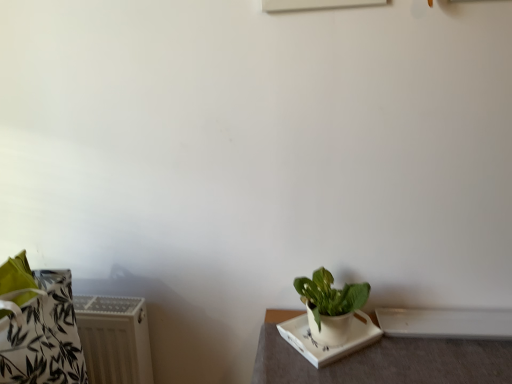
Identify the location of white ceramic plate at lower right. (326, 345).

Locate an element on the screen. white ceramic tray at lower right is located at coordinates (384, 360).

Image resolution: width=512 pixels, height=384 pixels. What do you see at coordinates (445, 323) in the screenshot? I see `white glossy window sill at lower right` at bounding box center [445, 323].

Identify the location of white ceramic plate at lower right. (326, 345).

The image size is (512, 384). I want to click on table that appears below the white ceramic plate at lower right (from a real-world perspective), so click(384, 360).

Is white ceramic tray at lower right touching white ceramic plate at lower right?

Yes, white ceramic tray at lower right and white ceramic plate at lower right clearly make contact.

Considering the positions of points (385, 356) and (322, 358), is point (385, 356) closer to camera compared to point (322, 358)?

No.

Which is correct: white glossy window sill at lower right is inside white ceramic tray at lower right, or outside of it?

white glossy window sill at lower right fits inside white ceramic tray at lower right.

From the image's perspective, is white glossy window sill at lower right positioned above or below white ceramic tray at lower right?

Based on their image positions, white glossy window sill at lower right is located above white ceramic tray at lower right.

Is white glossy window sill at lower right closer to the viewer compared to white ceramic tray at lower right?

No, white glossy window sill at lower right is behind white ceramic tray at lower right.

In order to click on houseplant that appears on the left of white glossy window sill at lower right in this screenshot , I will do `click(330, 305)`.

Which object is further away from the camera taking this photo, white glossy window sill at lower right or green matte plant at lower right?

white glossy window sill at lower right is behind.

Which is behind, point (475, 334) or point (356, 297)?

The point (475, 334) is behind.

In the scene shown: Is white glossy window sill at lower right facing towards green matte plant at lower right?

No, white glossy window sill at lower right is not aimed at green matte plant at lower right.

Considering the sizes of objects white glossy window sill at lower right and white ceramic plate at lower right in the image provided, who is wider, white glossy window sill at lower right or white ceramic plate at lower right?

Wider between the two is white ceramic plate at lower right.

Which of these two, white glossy window sill at lower right or white ceramic plate at lower right, stands taller?

white ceramic plate at lower right is taller.

Is white ceramic plate at lower right at the back of white glossy window sill at lower right?

white glossy window sill at lower right does not have its back to white ceramic plate at lower right.

Which object is further away from the camera, white glossy window sill at lower right or white ceramic plate at lower right?

white glossy window sill at lower right is further away from the camera.

Which object is positioned more to the right, white ceramic plate at lower right or green matte plant at lower right?

green matte plant at lower right.

Is white ceramic plate at lower right bigger than green matte plant at lower right?

Actually, white ceramic plate at lower right might be smaller than green matte plant at lower right.

Between point (353, 326) and point (343, 342), which one is positioned behind?

The point (353, 326) is more distant.

The height and width of the screenshot is (384, 512). Find the location of `plate located on the left of green matte plant at lower right`. plate located on the left of green matte plant at lower right is located at coordinates (326, 345).

Is white textured radiator at lower left bigger or smaller than white ceramic plate at lower right?

white textured radiator at lower left is bigger than white ceramic plate at lower right.

Based on the photo, which point is more forward, (93, 366) or (290, 323)?

The point (290, 323) is closer to the camera.

Is white textured radiator at lower left far from white ceramic plate at lower right?

No, white textured radiator at lower left is not far away from white ceramic plate at lower right.

Locate an element on the screen. The height and width of the screenshot is (384, 512). plate on the right side of white textured radiator at lower left is located at coordinates (326, 345).

The image size is (512, 384). Find the location of `table that is under the green matte plant at lower right (from a real-world perspective)`. table that is under the green matte plant at lower right (from a real-world perspective) is located at coordinates (384, 360).

In the scene shown: Is green matte plant at lower right to the left or to the right of white ceramic tray at lower right in the image?

green matte plant at lower right is to the left of white ceramic tray at lower right.

Considering the sizes of objects green matte plant at lower right and white ceramic tray at lower right in the image provided, who is taller, green matte plant at lower right or white ceramic tray at lower right?

white ceramic tray at lower right.

Does green matte plant at lower right turn towards white ceramic tray at lower right?

No, green matte plant at lower right is not oriented towards white ceramic tray at lower right.

This screenshot has width=512, height=384. Identify the location of plate above the white ceramic tray at lower right (from the image's perspective). (326, 345).

Locate an element on the screen. The width and height of the screenshot is (512, 384). table in front of the white glossy window sill at lower right is located at coordinates (384, 360).

Consider the image. Estimate the real-world distances between objects in this image. Which object is closer to white ceramic plate at lower right, white ceramic tray at lower right or white textured radiator at lower left?

white ceramic tray at lower right is closer to white ceramic plate at lower right.

From the image, which object appears to be farther from white ceramic tray at lower right, white textured radiator at lower left or white glossy window sill at lower right?

white textured radiator at lower left lies further to white ceramic tray at lower right than the other object.

From the image, which object appears to be nearer to white ceramic tray at lower right, green matte plant at lower right or white glossy window sill at lower right?

white glossy window sill at lower right lies closer to white ceramic tray at lower right than the other object.

Looking at the image, which one is located further to white ceramic tray at lower right, white ceramic plate at lower right or white glossy window sill at lower right?

The object further to white ceramic tray at lower right is white glossy window sill at lower right.

From the image, which object appears to be farther from white ceramic tray at lower right, white glossy window sill at lower right or green matte plant at lower right?

green matte plant at lower right lies further to white ceramic tray at lower right than the other object.

Based on their spatial positions, is white glossy window sill at lower right or white ceramic tray at lower right further from white ceramic plate at lower right?

The object further to white ceramic plate at lower right is white glossy window sill at lower right.

Looking at the image, which one is located further to white textured radiator at lower left, green matte plant at lower right or white glossy window sill at lower right?

The object further to white textured radiator at lower left is white glossy window sill at lower right.

Based on their spatial positions, is white glossy window sill at lower right or green matte plant at lower right further from white ceramic plate at lower right?

white glossy window sill at lower right is positioned further to the anchor white ceramic plate at lower right.

Where is `plate between green matte plant at lower right and white ceramic tray at lower right in the up-down direction`? plate between green matte plant at lower right and white ceramic tray at lower right in the up-down direction is located at coordinates (326, 345).

You are a GUI agent. You are given a task and a screenshot of the screen. Output one action in this format:
    pyautogui.click(x=<x>, y=<y>)
    Task: Click on the houseplant between white textured radiator at lower left and white glossy window sill at lower right from left to right
    The height and width of the screenshot is (384, 512).
    Given the screenshot: What is the action you would take?
    pyautogui.click(x=330, y=305)

Locate an element on the screen. The image size is (512, 384). plate situated between white textured radiator at lower left and green matte plant at lower right from left to right is located at coordinates (326, 345).

This screenshot has width=512, height=384. I want to click on table between white textured radiator at lower left and white glossy window sill at lower right in the horizontal direction, so click(x=384, y=360).